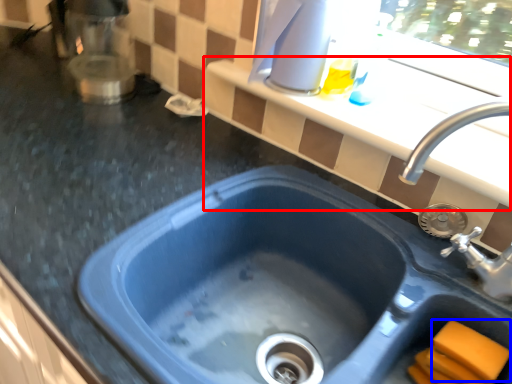
Question: Which object appears closest to the camera in this image, window sill (highlighted by a red box) or soap (highlighted by a blue box)?

Choices:
 (A) window sill
 (B) soap

Answer: (B)